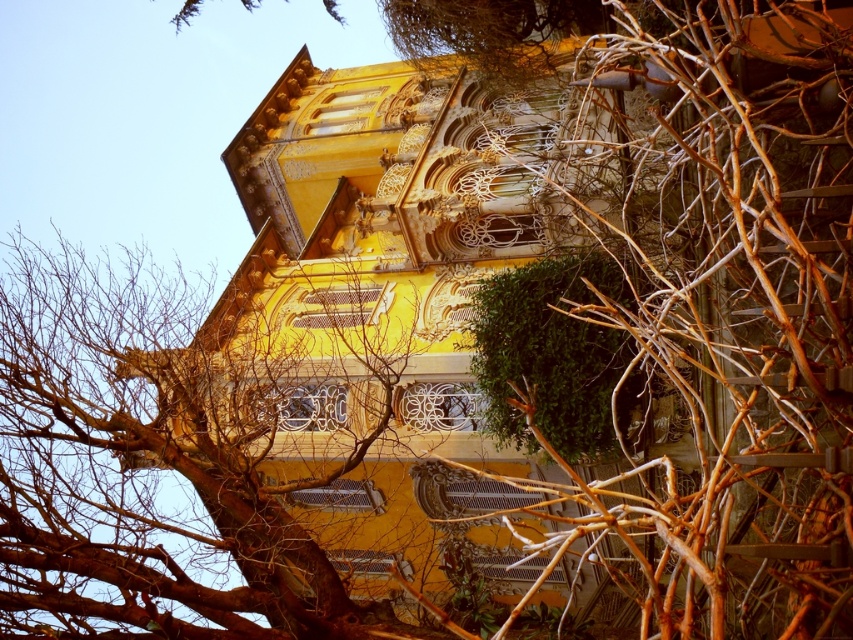
Is brown woody branches at center bigger than brown bark tree at upper left?

No, brown woody branches at center is not bigger than brown bark tree at upper left.

Between point (706, 465) and point (207, 547), which one is positioned in front?

Point (706, 465) is more forward.

This screenshot has height=640, width=853. Describe the element at coordinates (734, 310) in the screenshot. I see `brown woody branches at center` at that location.

Locate an element on the screen. brown woody branches at center is located at coordinates (734, 310).

Is brown bark tree at upper left below green leafy bush at center?

Correct, brown bark tree at upper left is located below green leafy bush at center.

This screenshot has width=853, height=640. What do you see at coordinates (136, 468) in the screenshot? I see `brown bark tree at upper left` at bounding box center [136, 468].

The height and width of the screenshot is (640, 853). In order to click on brown bark tree at upper left in this screenshot , I will do `click(136, 468)`.

Can you confirm if brown woody branches at center is thinner than green leafy bush at center?

No, brown woody branches at center is not thinner than green leafy bush at center.

At what (x,y) coordinates should I click in order to perform the action: click on brown woody branches at center. Please return your answer as a coordinate pair (x, y). Looking at the image, I should click on (734, 310).

At what (x,y) coordinates should I click in order to perform the action: click on brown woody branches at center. Please return your answer as a coordinate pair (x, y). The height and width of the screenshot is (640, 853). Looking at the image, I should click on [x=734, y=310].